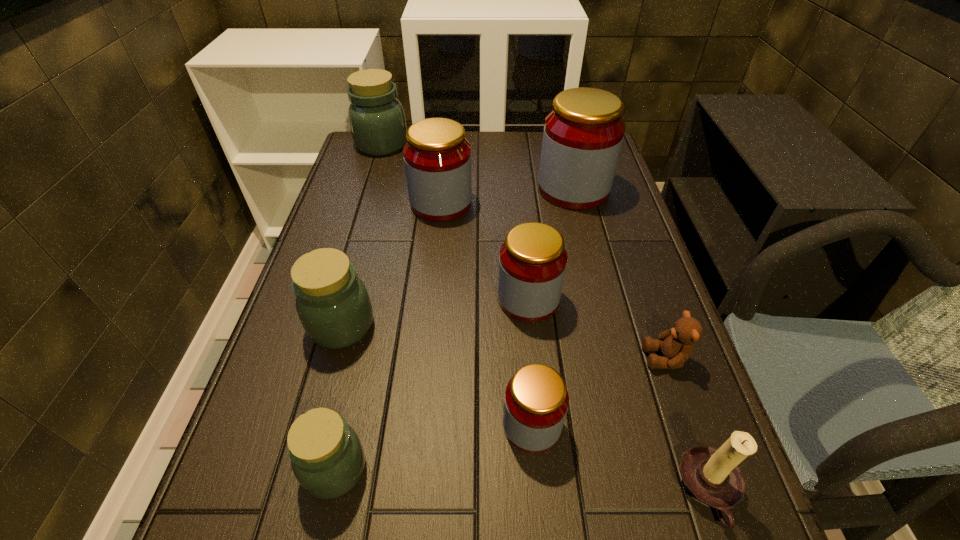
I want to click on free region at the left edge of the desktop, so click(x=334, y=206).

In order to click on vacant space at the right edge in this screenshot , I will do `click(612, 191)`.

Find the location of a particular element. The height and width of the screenshot is (540, 960). free space at the far left corner of the desktop is located at coordinates (362, 163).

Locate an element on the screen. This screenshot has width=960, height=540. empty space that is in between the leftmost red jar and the nearest red jar is located at coordinates (487, 314).

At what (x,y) coordinates should I click in order to perform the action: click on vacant region between the farthest green jar and the nearest red jar. Please return your answer as a coordinate pair (x, y). The height and width of the screenshot is (540, 960). Looking at the image, I should click on (457, 285).

The image size is (960, 540). I want to click on vacant region between the tallest jar and the second nearest green jar, so click(458, 257).

Where is `free space that is in between the second farthest green jar and the nearest green jar`? The height and width of the screenshot is (540, 960). free space that is in between the second farthest green jar and the nearest green jar is located at coordinates (338, 397).

The image size is (960, 540). In order to click on free spot between the brown teddy bear and the candle holder in this screenshot , I will do `click(687, 424)`.

Locate an element on the screen. The width and height of the screenshot is (960, 540). vacant point located between the teddy bear and the nearest green jar is located at coordinates (500, 413).

Find the location of a particular element. unoccupied position between the third smallest red jar and the candle holder is located at coordinates (575, 347).